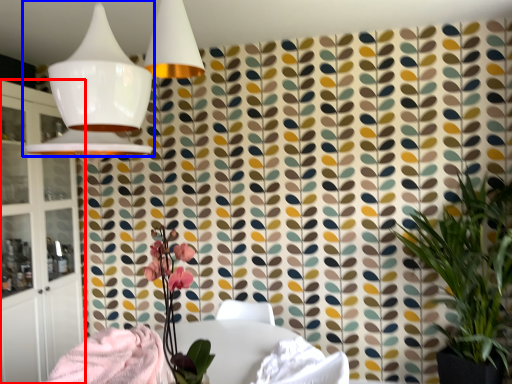
Question: Which of the following is the closest to the observer, cabinetry (highlighted by a red box) or lamp (highlighted by a blue box)?

Choices:
 (A) cabinetry
 (B) lamp

Answer: (B)